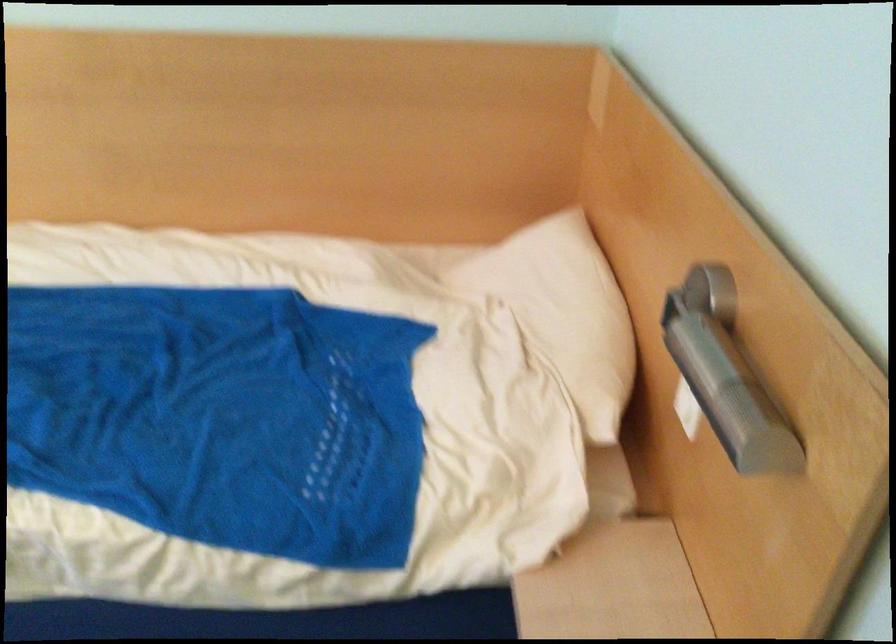
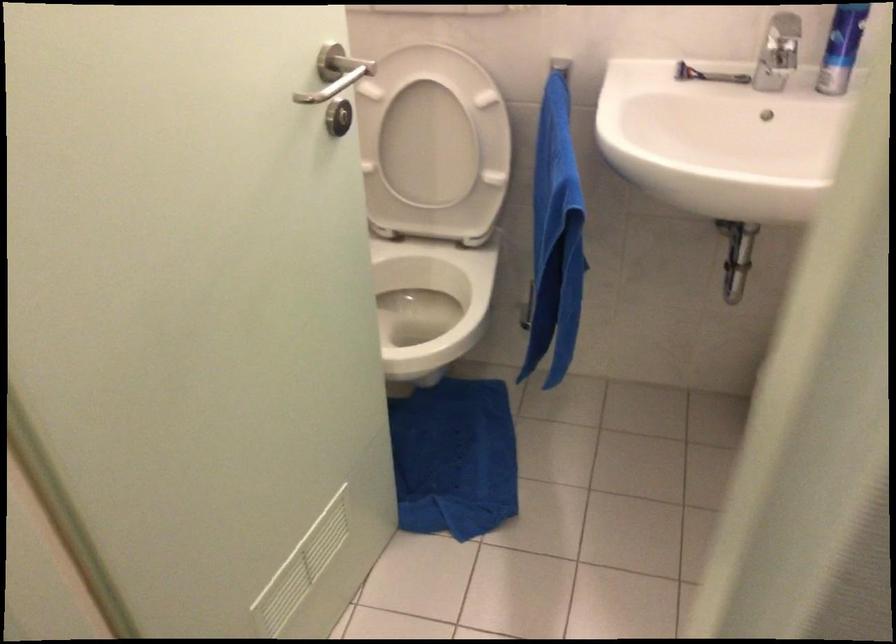
Question: Which direction would the cameraman need to move to produce the second image? Reply with the corresponding letter.

Choices:
 (A) Left
 (B) Right
 (C) Forward
 (D) Backward

Answer: (B)